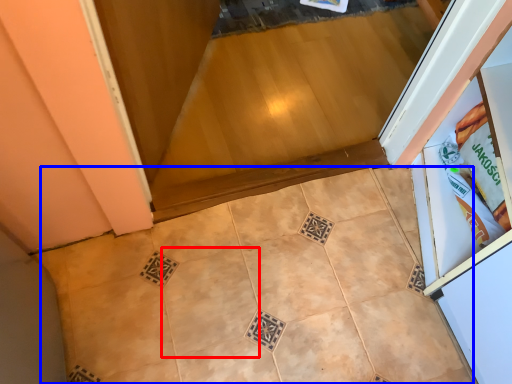
Question: Among these objects, which one is nearest to the camera, ceramic tile (highlighted by a red box) or ceramic tile (highlighted by a blue box)?

Choices:
 (A) ceramic tile
 (B) ceramic tile

Answer: (B)